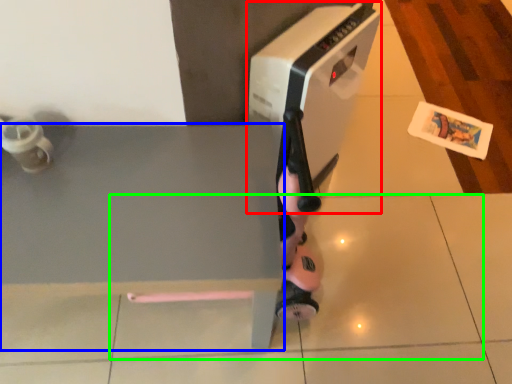
Question: Based on their relative distances, which object is nearer to home appliance (highlighted by a red box)? Choose from table (highlighted by a blue box) and tile (highlighted by a green box).

Choices:
 (A) table
 (B) tile

Answer: (A)